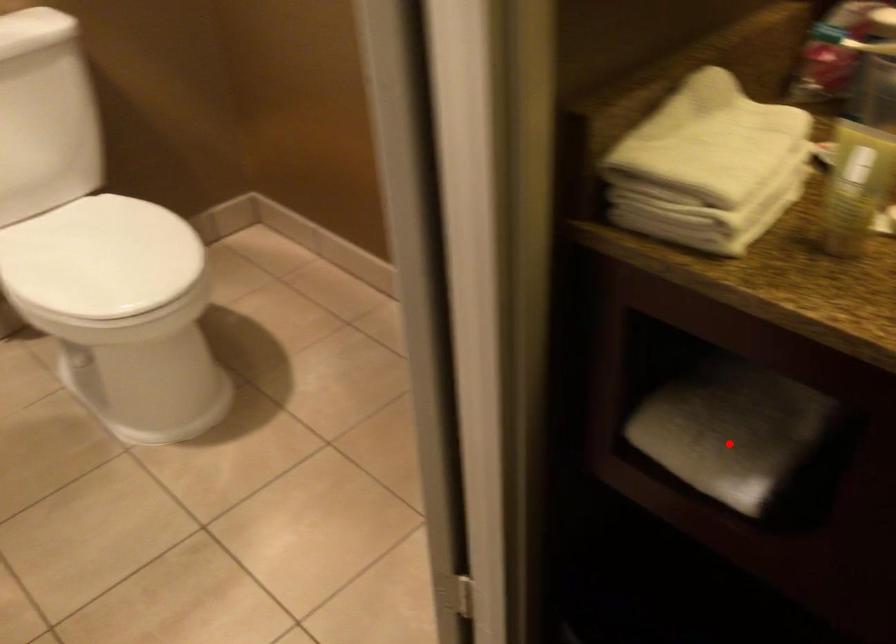
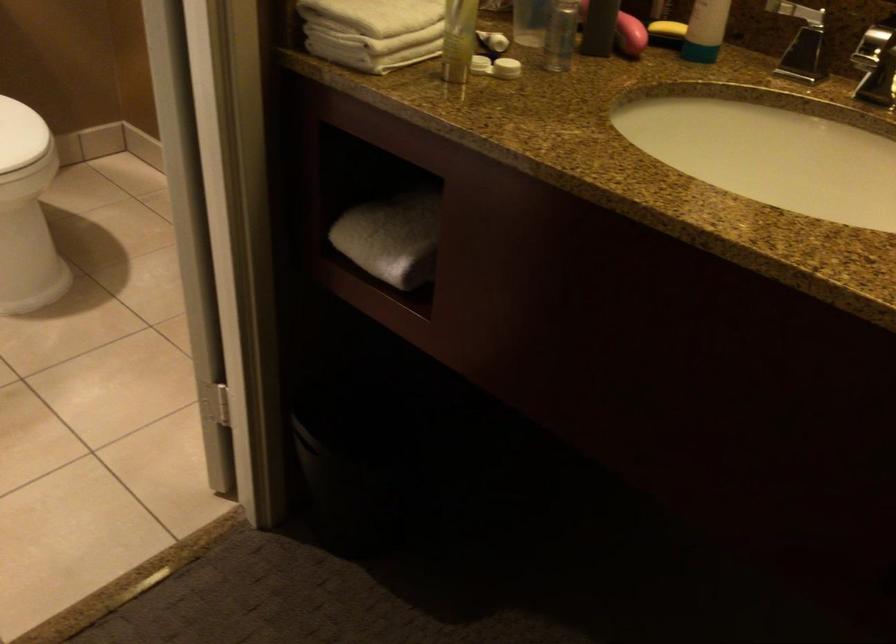
Where in the second image is the point corresponding to the highlighted location from the first image?

(392, 238)